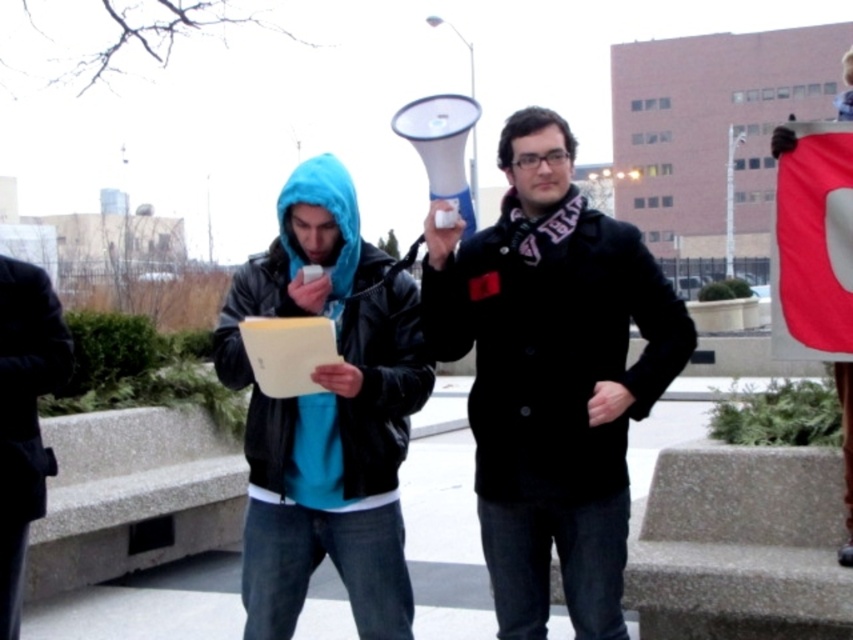
You are part of a crowd at a protest and need to pass through the area where the black wool coat at center and the black leather jacket at left are located. Can you walk between them without going around?

The black leather jacket at left is behind the black wool coat at center, so you cannot walk between them directly. You would need to go around them.

You are organizing a protest and need to decide which coat to wear for visibility. The black wool coat at center and the black leather jacket at left are options. Based on their sizes, which one might be more noticeable from a distance?

The black leather jacket at left is wider than the black wool coat at center, so it might be more noticeable from a distance due to its larger size.